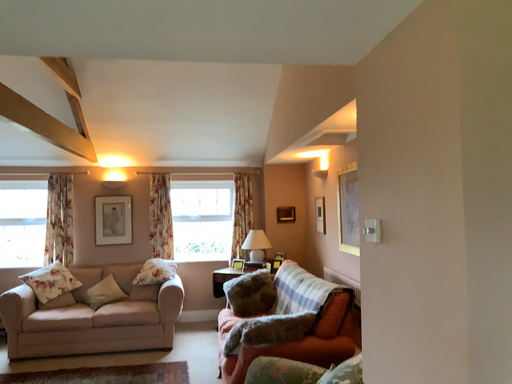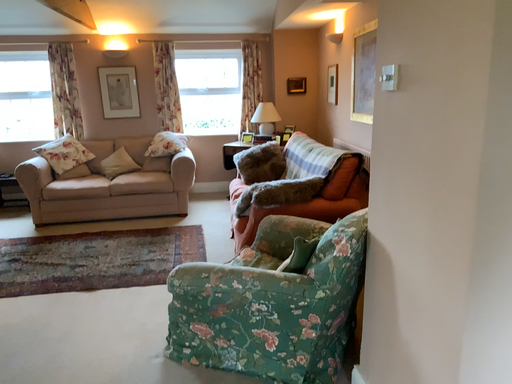
Question: How did the camera likely rotate when shooting the video?

Choices:
 (A) rotated upward
 (B) rotated downward

Answer: (B)